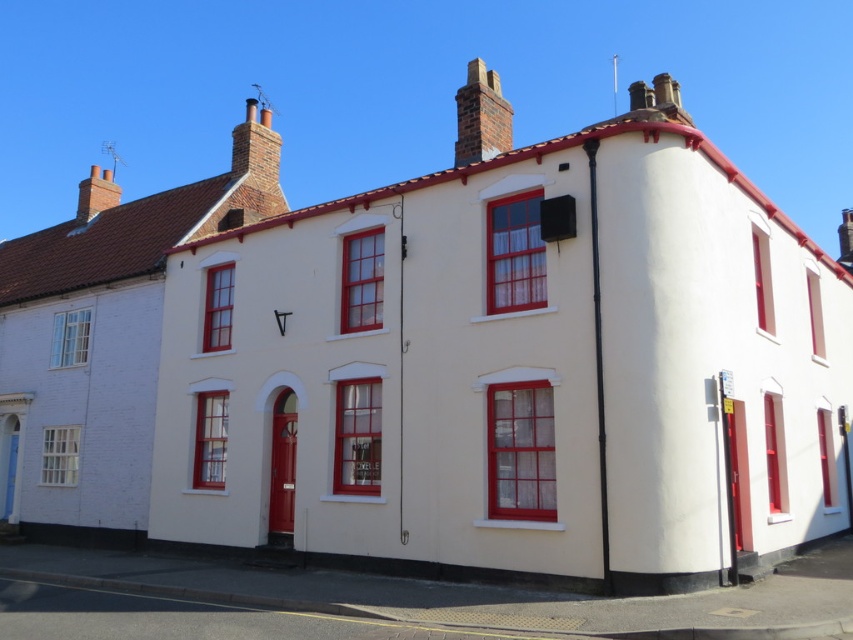
You are an architect designing a new building inspired by this image. You need to decide the size of the white painted wood trim at center and the brick chimney at upper center. Which one should you make larger?

The white painted wood trim at center is bigger than the brick chimney at upper center, so you should make the white painted wood trim at center larger than the brick chimney at upper center.

You are standing in front of the building and notice a specific point marked at coordinates (515,369). What object is located at that exact point?

The white painted wood trim at center is located at point (515,369).